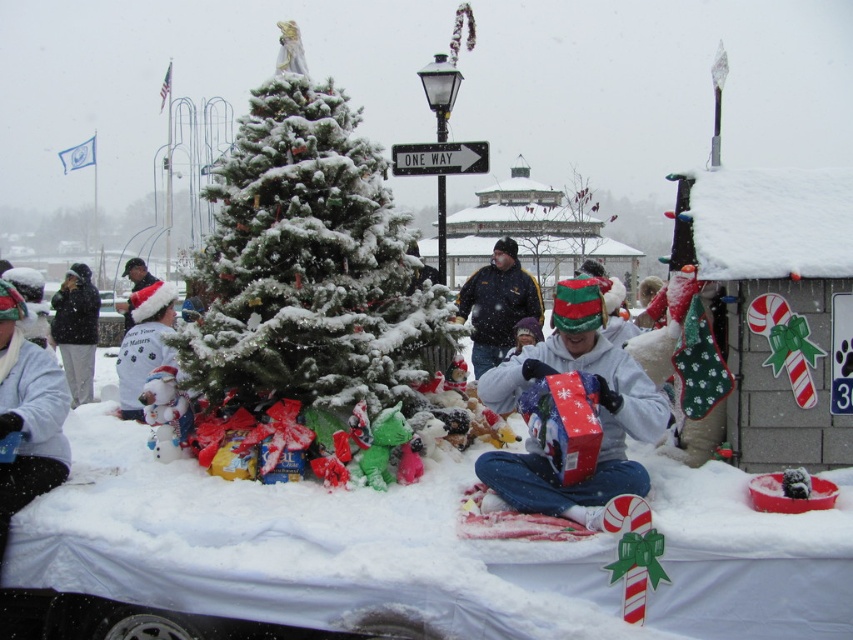
You are organizing a winter photoshoot and need to place two models on the float. The first model is wearing a dark blue jacket at center, and the second is wearing a white fleece shirt at left. Which model should you position closer to the edge of the float to ensure both fit comfortably?

The dark blue jacket at center is wider than the white fleece shirt at left, so positioning the model in the dark blue jacket at center closer to the edge would allow both models to fit comfortably on the float.

You are organizing a winter photoshoot and need to arrange two models wearing the dark blue jacket at center and white fleece shirt at left. Based on their positions and sizes, which model should stand in front to ensure both are visible in the photo?

The dark blue jacket at center should stand in front because it has a greater height than the white fleece shirt at left, allowing both models to be visible without blocking each other.